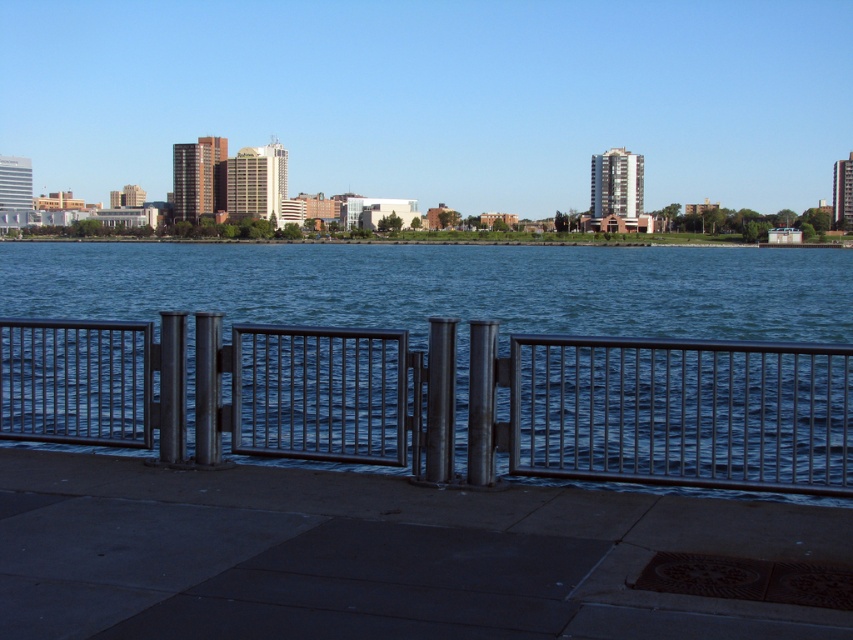
Question: Is smooth concrete dock at lower center behind polished metal gate at center?

Choices:
 (A) yes
 (B) no

Answer: (B)

Question: Which object appears closest to the camera in this image?

Choices:
 (A) smooth concrete dock at lower center
 (B) polished metal gate at center

Answer: (A)

Question: Is the position of smooth concrete dock at lower center less distant than that of polished metal gate at center?

Choices:
 (A) no
 (B) yes

Answer: (B)

Question: Which point is closer to the camera?

Choices:
 (A) polished metal gate at center
 (B) smooth concrete dock at lower center

Answer: (B)

Question: Is smooth concrete dock at lower center above polished metal gate at center?

Choices:
 (A) no
 (B) yes

Answer: (A)